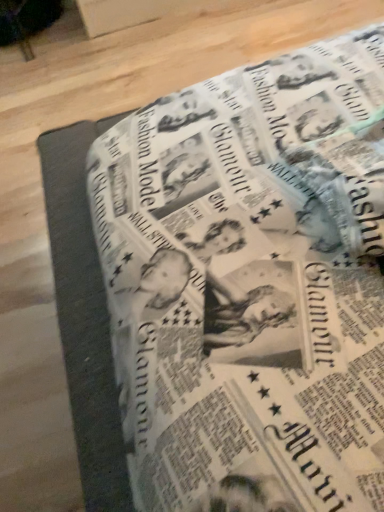
The image size is (384, 512). What do you see at coordinates (251, 284) in the screenshot?
I see `white printed magazine at center` at bounding box center [251, 284].

In the scene shown: What is the approximate width of white printed magazine at center?

It is 3.42 feet.

This screenshot has height=512, width=384. I want to click on white printed magazine at center, so click(x=251, y=284).

The width and height of the screenshot is (384, 512). I want to click on white printed magazine at center, so click(251, 284).